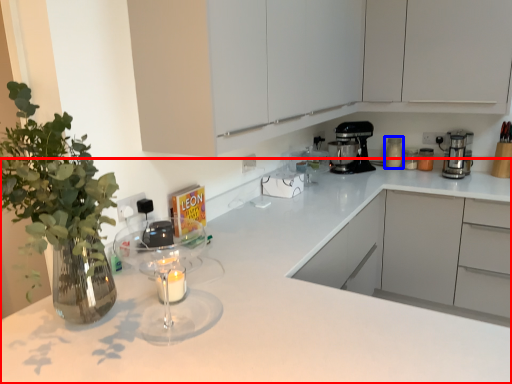
Question: Which point is further to the camera, countertop (highlighted by a red box) or kitchen appliance (highlighted by a blue box)?

Choices:
 (A) countertop
 (B) kitchen appliance

Answer: (B)